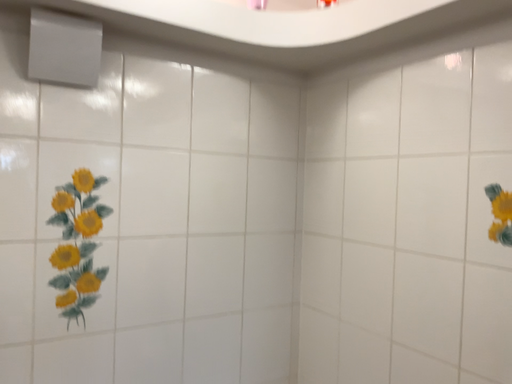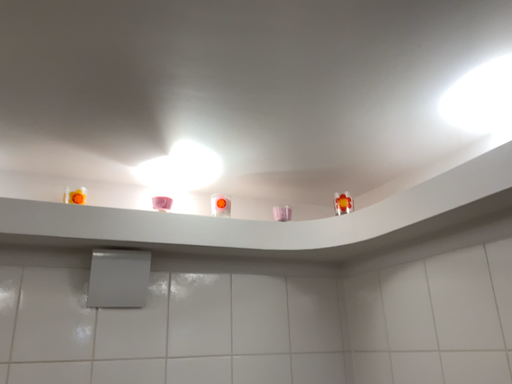
Question: How did the camera likely rotate when shooting the video?

Choices:
 (A) rotated downward
 (B) rotated upward

Answer: (B)